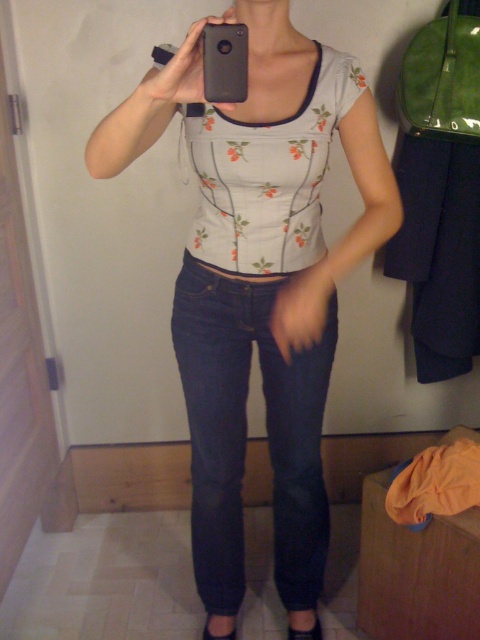
Question: From the image, what is the correct spatial relationship of dark blue denim jeans at center in relation to black matte phone at upper center?

Choices:
 (A) right
 (B) left

Answer: (A)

Question: Among these points, which one is farthest from the camera?

Choices:
 (A) click(206, 109)
 (B) click(316, 420)

Answer: (B)

Question: Is denim jeans at center positioned before black matte phone at upper center?

Choices:
 (A) yes
 (B) no

Answer: (A)

Question: Which object is closer to the camera taking this photo?

Choices:
 (A) denim jeans at center
 (B) dark blue denim jeans at center
 (C) black matte phone at upper center

Answer: (A)

Question: Can you confirm if denim jeans at center is wider than dark blue denim jeans at center?

Choices:
 (A) yes
 (B) no

Answer: (A)

Question: Which point is closer to the camera?

Choices:
 (A) denim jeans at center
 (B) black matte phone at upper center

Answer: (A)